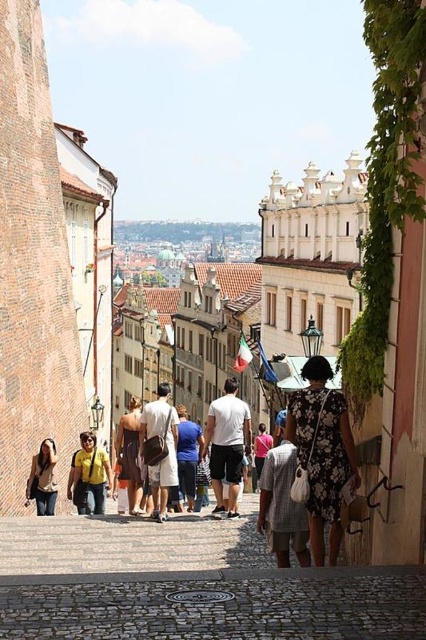
Can you confirm if floral dress at center is shorter than white cotton t-shirt at center?

No, floral dress at center is not shorter than white cotton t-shirt at center.

Does point (339, 538) come closer to viewer compared to point (241, 440)?

That is True.

What do you see at coordinates (322, 452) in the screenshot?
I see `floral dress at center` at bounding box center [322, 452].

The image size is (426, 640). Find the location of `floral dress at center`. floral dress at center is located at coordinates (322, 452).

Based on the photo, can you confirm if cobblestone path at center is bigger than white cotton shirt at center?

Incorrect, cobblestone path at center is not larger than white cotton shirt at center.

Between point (275, 596) and point (146, 461), which one is positioned behind?

The point (146, 461) is more distant.

Locate an element on the screen. The width and height of the screenshot is (426, 640). cobblestone path at center is located at coordinates (189, 584).

This screenshot has width=426, height=640. Describe the element at coordinates (89, 476) in the screenshot. I see `yellow fabric shirt at center` at that location.

Measure the distance between yellow fabric shirt at center and camera.

yellow fabric shirt at center and camera are 49.96 meters apart.

The height and width of the screenshot is (640, 426). I want to click on yellow fabric shirt at center, so click(89, 476).